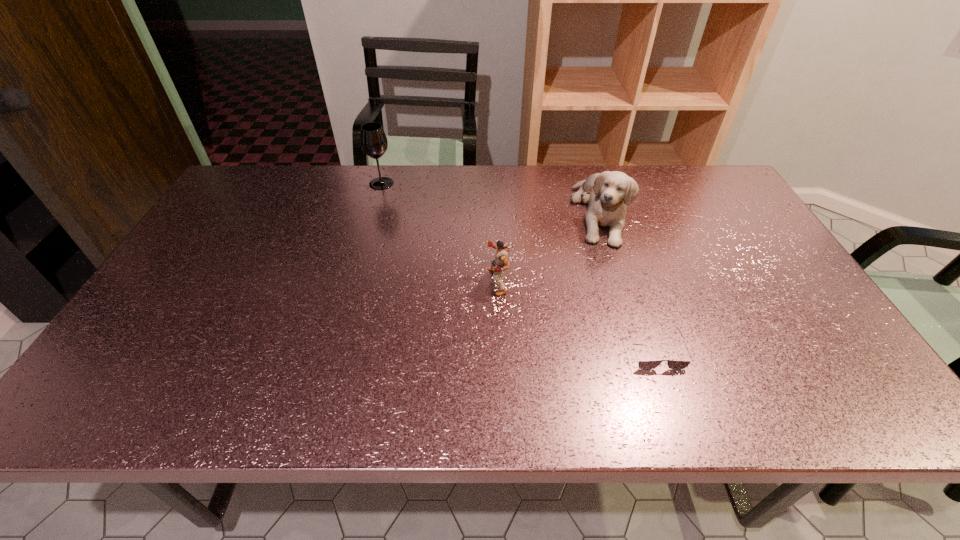
Image resolution: width=960 pixels, height=540 pixels. I want to click on free spot located on the front-facing side of the third tallest object, so click(x=463, y=281).

Identify the location of vacant region located 0.110m on the front-facing side of the shortest object. (678, 417).

Where is `wineglass situated at the far edge`? wineglass situated at the far edge is located at coordinates (373, 140).

I want to click on puppy at the far edge, so click(x=609, y=192).

The height and width of the screenshot is (540, 960). In the image, there is a desktop. In order to click on vacant space at the far edge in this screenshot , I will do `click(590, 171)`.

The width and height of the screenshot is (960, 540). Find the location of `free space at the near edge`. free space at the near edge is located at coordinates (286, 402).

The image size is (960, 540). I want to click on free space at the left edge, so click(253, 232).

Where is `vacant area at the far left corner of the desktop`? This screenshot has width=960, height=540. vacant area at the far left corner of the desktop is located at coordinates (259, 187).

The image size is (960, 540). In the image, there is a desktop. Identify the location of vacant space at the near left corner. (97, 404).

Locate an element on the screen. This screenshot has height=540, width=960. free region at the far right corner of the desktop is located at coordinates (680, 182).